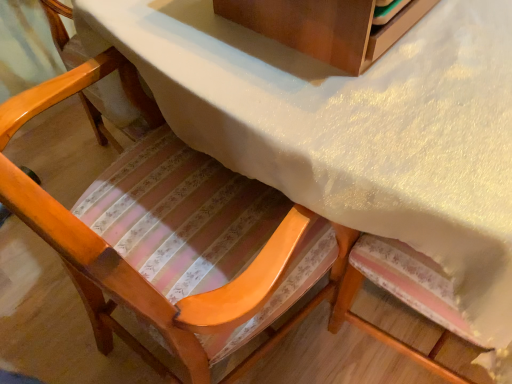
Measure the distance between matte brown cardboard at upper center and camera.

matte brown cardboard at upper center is 21.27 inches away from camera.

Measure the distance between point (257,29) and camera.

Point (257,29) and camera are 68.90 centimeters apart.

The image size is (512, 384). I want to click on matte brown cardboard at upper center, so click(x=326, y=27).

This screenshot has width=512, height=384. What do you see at coordinates (326, 27) in the screenshot?
I see `matte brown cardboard at upper center` at bounding box center [326, 27].

From the picture: What is the approximate height of matte brown cardboard at upper center?

The height of matte brown cardboard at upper center is 7.00 inches.

Find the location of `matte brown cardboard at upper center`. matte brown cardboard at upper center is located at coordinates (326, 27).